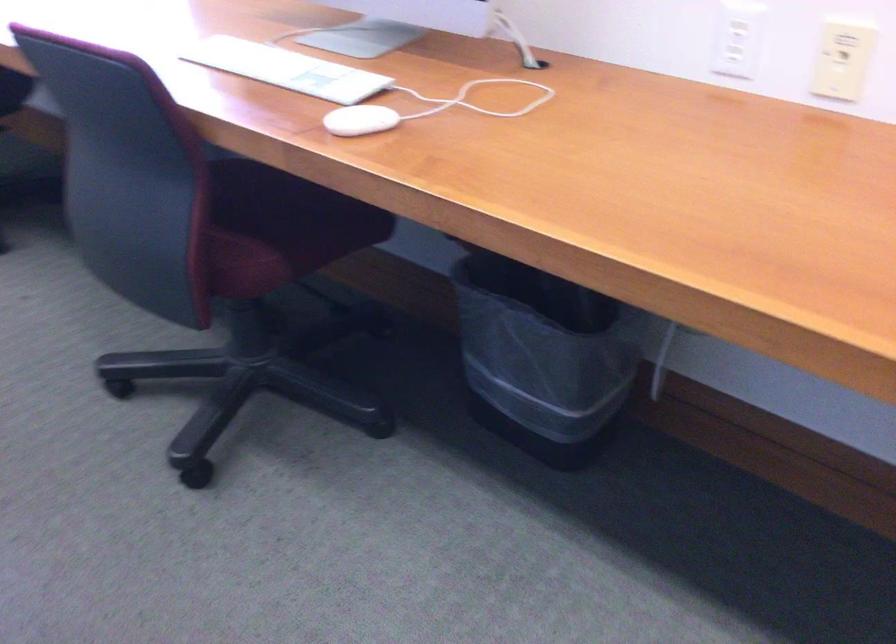
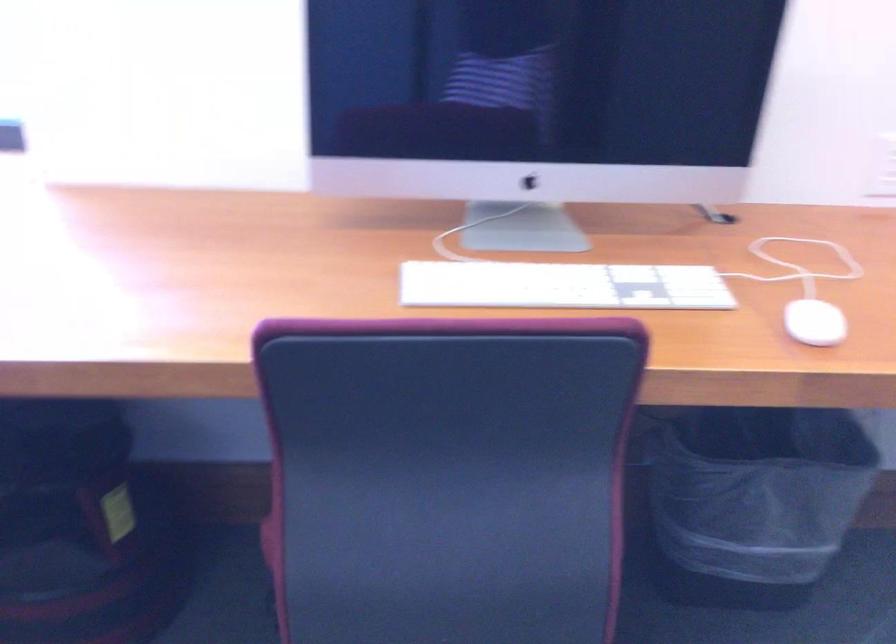
Locate, in the second image, the point that corresponds to the point at 487,330 in the first image.

(753, 500)